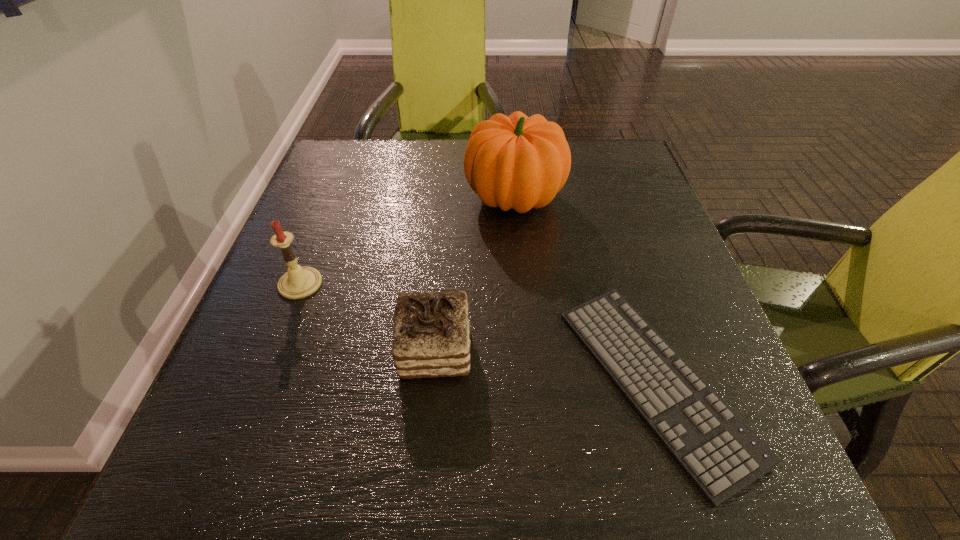
Where is `vacant area that lies between the computer keyboard and the candle`? Image resolution: width=960 pixels, height=540 pixels. vacant area that lies between the computer keyboard and the candle is located at coordinates (478, 333).

Where is `object that is the second closest to the shortest object`? The width and height of the screenshot is (960, 540). object that is the second closest to the shortest object is located at coordinates (519, 162).

Select which object appears as the second closest to the farthest object. Please provide its 2D coordinates. Your answer should be formatted as a tuple, i.e. [(x, y)], where the tuple contains the x and y coordinates of a point satisfying the conditions above.

[(431, 338)]

Locate an element on the screen. The height and width of the screenshot is (540, 960). vacant space that satisfies the following two spatial constraints: 1. on the back side of the tallest object; 2. on the left side of the third tallest object is located at coordinates (448, 198).

Image resolution: width=960 pixels, height=540 pixels. I want to click on free space that satisfies the following two spatial constraints: 1. on the front side of the second tallest object; 2. on the right side of the third tallest object, so click(x=275, y=350).

This screenshot has height=540, width=960. Find the location of `free space in the image that satisfies the following two spatial constraints: 1. on the front side of the chocolate cake; 2. on the left side of the leftmost object`. free space in the image that satisfies the following two spatial constraints: 1. on the front side of the chocolate cake; 2. on the left side of the leftmost object is located at coordinates (275, 350).